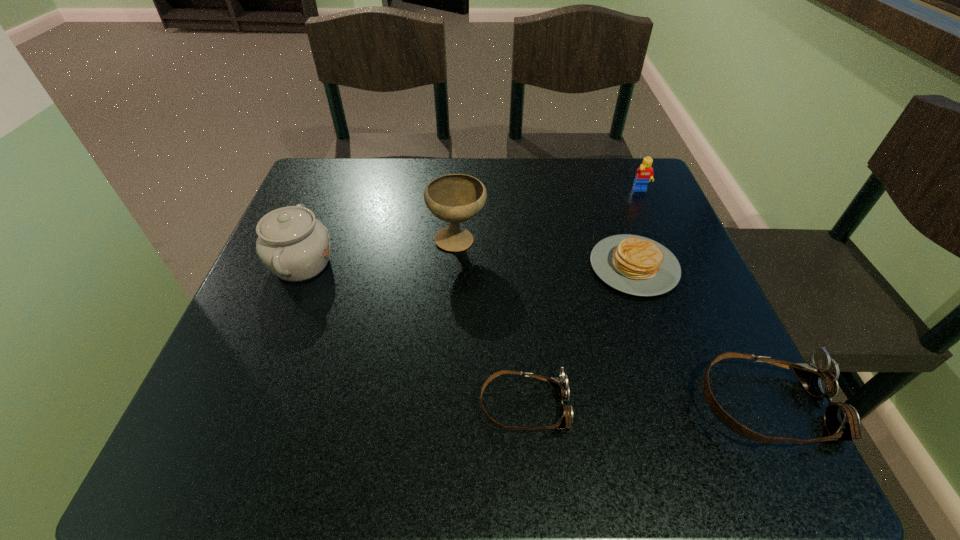
Find the location of a particular element. free spot at the far edge of the desktop is located at coordinates (514, 204).

Where is `vacant area at the left edge of the desktop`? The width and height of the screenshot is (960, 540). vacant area at the left edge of the desktop is located at coordinates (263, 267).

The image size is (960, 540). In the image, there is a desktop. What are the coordinates of `vacant region at the right edge` in the screenshot? It's located at (665, 308).

The height and width of the screenshot is (540, 960). In order to click on blank space at the far left corner in this screenshot , I will do `click(328, 168)`.

I want to click on vacant position at the far right corner of the desktop, so click(588, 158).

I want to click on free space between the shorter goggles and the Lego, so click(583, 299).

Locate an element on the screen. free space between the chalice and the pancake is located at coordinates (546, 254).

Identify the location of free space that is in between the right goggles and the pancake. (700, 336).

The image size is (960, 540). In order to click on free space between the pancake and the farthest object in this screenshot , I will do `click(637, 229)`.

This screenshot has width=960, height=540. I want to click on free space between the third shortest object and the Lego, so (x=703, y=299).